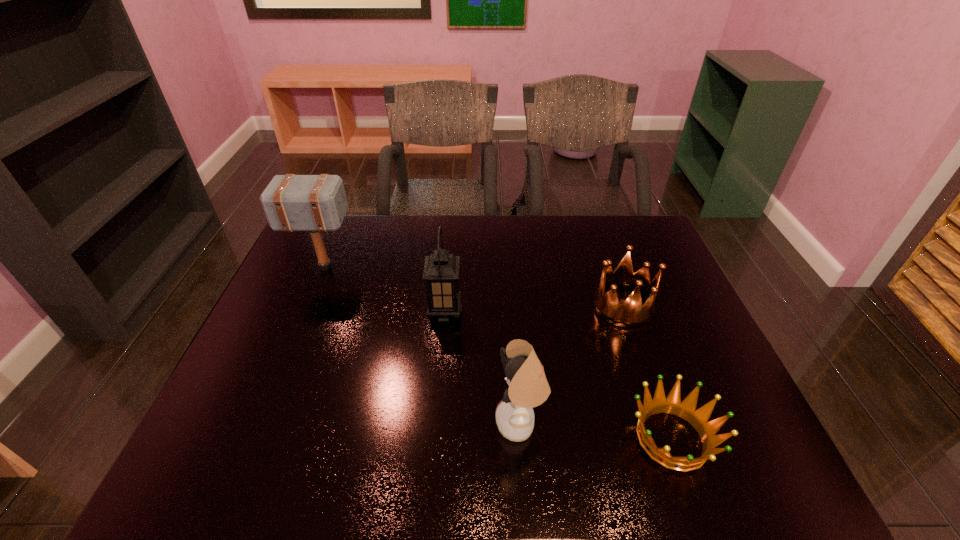
Locate an element on the screen. mallet is located at coordinates (315, 203).

You are a GUI agent. You are given a task and a screenshot of the screen. Output one action in this format:
    pyautogui.click(x=<x>, y=<y>)
    Task: Click on the leftmost object
    
    Given the screenshot: What is the action you would take?
    pyautogui.click(x=315, y=203)

Find the location of `the second object from left to right`. the second object from left to right is located at coordinates (441, 270).

Where is `doll`? The width and height of the screenshot is (960, 540). doll is located at coordinates (528, 387).

Locate an element on the screen. This screenshot has width=960, height=540. the taller crown is located at coordinates (631, 313).

At what (x,y) coordinates should I click in order to perform the action: click on the second shortest object. Please return your answer as a coordinate pair (x, y). The image size is (960, 540). Looking at the image, I should click on (631, 313).

I want to click on the shortest object, so click(x=686, y=409).

You are a GUI agent. You are given a task and a screenshot of the screen. Output one action in this format:
    pyautogui.click(x=<x>, y=<y>)
    Task: Click on the shorter crown
    Image resolution: width=960 pixels, height=540 pixels.
    Given the screenshot: What is the action you would take?
    pyautogui.click(x=686, y=409)

At what (x,y) coordinates should I click in order to perform the action: click on free region located 0.280m on the striking surface of the farthest object. Please return your answer as a coordinate pair (x, y). The height and width of the screenshot is (540, 960). Looking at the image, I should click on (445, 268).

Identify the location of free location located on the left of the second object from left to right. (381, 313).